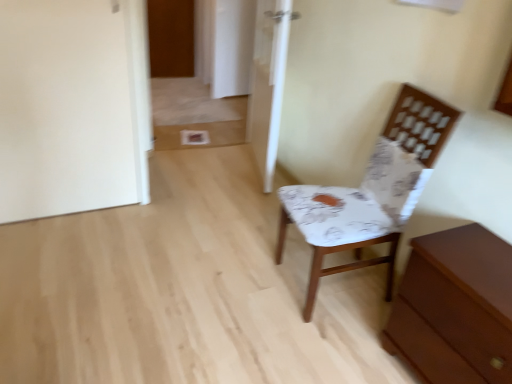
What do you see at coordinates (371, 192) in the screenshot?
I see `white fabric chair at right` at bounding box center [371, 192].

The height and width of the screenshot is (384, 512). Identify the location of white glossy door at center, arranged as the 1th door when ordered from the bottom. (268, 82).

Identify the location of white fabric chair at right. Image resolution: width=512 pixels, height=384 pixels. (371, 192).

Is white fabric chair at right oriented away from white glossy door at center, arranged as the 1th door when ordered from the bottom?

No, white fabric chair at right is not facing the opposite direction of white glossy door at center, arranged as the 1th door when ordered from the bottom.

Which is in front, white fabric chair at right or white glossy door at center, placed as the second door when sorted from top to bottom?

white fabric chair at right.

From the image's perspective, which one is positioned lower, white fabric chair at right or white glossy door at center, which is the second door in left-to-right order?

white fabric chair at right.

Could you measure the distance between white fabric chair at right and white glossy door at center, placed as the second door when sorted from top to bottom?

They are 3.69 feet apart.

Considering the points (150, 67) and (394, 252), which point is in front, point (150, 67) or point (394, 252)?

The point (394, 252) is closer.

There is a white fabric chair at right. Where is `the 2nd door above it (from the image's perspective)`? Image resolution: width=512 pixels, height=384 pixels. the 2nd door above it (from the image's perspective) is located at coordinates (170, 37).

Is wooden door at upper left, positioned as the second door in bottom-to-top order, facing towards white fabric chair at right?

Yes, wooden door at upper left, positioned as the second door in bottom-to-top order, is turned towards white fabric chair at right.

Between point (284, 28) and point (295, 207), which one is positioned behind?

Positioned behind is point (284, 28).

From the picture: From a real-world perspective, between white glossy door at center, arranged as the 1th door when ordered from the bottom, and white fabric chair at right, who is vertically lower?

white fabric chair at right, from a real-world perspective.

How much distance is there between white glossy door at center, arranged as the 1th door when ordered from the bottom, and white fabric chair at right?

white glossy door at center, arranged as the 1th door when ordered from the bottom, is 3.69 feet away from white fabric chair at right.

Is brown wooden chest of drawers at lower right oriented towards wooden door at upper left, which is counted as the 2th door, starting from the right?

No.

Is the position of brown wooden chest of drawers at lower right less distant than that of wooden door at upper left, which is counted as the 2th door, starting from the right?

Yes, brown wooden chest of drawers at lower right is closer to the viewer.

Is brown wooden chest of drawers at lower right to the right of wooden door at upper left, which is counted as the 2th door, starting from the right, from the viewer's perspective?

Indeed, brown wooden chest of drawers at lower right is positioned on the right side of wooden door at upper left, which is counted as the 2th door, starting from the right.

Is wooden door at upper left, arranged as the first door when viewed from the back, outside of white glossy door at center, placed as the second door when sorted from top to bottom?

Yes.

From a real-world perspective, which object stands above the other?

white glossy door at center, the 2th door when ordered from back to front, is physically above.

Is brown wooden chest of drawers at lower right with white glossy door at center, arranged as the 1th door when ordered from the bottom?

No, brown wooden chest of drawers at lower right is not touching white glossy door at center, arranged as the 1th door when ordered from the bottom.

Which of these two, brown wooden chest of drawers at lower right or white glossy door at center, placed as the second door when sorted from top to bottom, stands shorter?

With less height is brown wooden chest of drawers at lower right.

Between brown wooden chest of drawers at lower right and white glossy door at center, the 2th door when ordered from back to front, which one has larger width?

With larger width is brown wooden chest of drawers at lower right.

From a real-world perspective, is brown wooden chest of drawers at lower right positioned under white glossy door at center, which is the second door in left-to-right order, based on gravity?

Indeed, from a real-world perspective, brown wooden chest of drawers at lower right is positioned beneath white glossy door at center, which is the second door in left-to-right order.

In the scene shown: Is brown wooden chest of drawers at lower right with white fabric chair at right?

No, brown wooden chest of drawers at lower right is not beside white fabric chair at right.

From a real-world perspective, is brown wooden chest of drawers at lower right physically above white fabric chair at right?

Actually, brown wooden chest of drawers at lower right is physically below white fabric chair at right in the real world.

Based on the photo, in terms of size, does brown wooden chest of drawers at lower right appear bigger or smaller than white fabric chair at right?

In the image, brown wooden chest of drawers at lower right appears to be smaller than white fabric chair at right.

Where is `chair below the white glossy door at center, the 2th door when ordered from back to front (from the image's perspective)`? This screenshot has width=512, height=384. chair below the white glossy door at center, the 2th door when ordered from back to front (from the image's perspective) is located at coordinates (371, 192).

This screenshot has height=384, width=512. Identify the location of chair on the right of the wooden door at upper left, acting as the first door starting from the left. (371, 192).

Looking at the image, which one is located further to wooden door at upper left, which is counted as the 2th door, starting from the right, white glossy door at center, placed as the second door when sorted from top to bottom, or brown wooden chest of drawers at lower right?

brown wooden chest of drawers at lower right is positioned further to the anchor wooden door at upper left, which is counted as the 2th door, starting from the right.

When comparing their distances from white glossy door at center, the 2th door when ordered from back to front, does brown wooden chest of drawers at lower right or white fabric chair at right seem closer?

white fabric chair at right is positioned closer to the anchor white glossy door at center, the 2th door when ordered from back to front.

Considering their positions, is white glossy door at center, placed as the second door when sorted from top to bottom, positioned further to white fabric chair at right than brown wooden chest of drawers at lower right?

Based on the image, white glossy door at center, placed as the second door when sorted from top to bottom, appears to be further to white fabric chair at right.

Which object lies nearer to the anchor point white glossy door at center, placed as the 1th door when sorted from right to left, wooden door at upper left, which is counted as the 1th door, starting from the top, or white fabric chair at right?

The object closer to white glossy door at center, placed as the 1th door when sorted from right to left, is white fabric chair at right.

Estimate the real-world distances between objects in this image. Which object is closer to brown wooden chest of drawers at lower right, white fabric chair at right or white glossy door at center, placed as the 1th door when sorted from right to left?

white fabric chair at right is positioned closer to the anchor brown wooden chest of drawers at lower right.

Considering their positions, is wooden door at upper left, arranged as the first door when viewed from the back, positioned closer to brown wooden chest of drawers at lower right than white fabric chair at right?

The object closer to brown wooden chest of drawers at lower right is white fabric chair at right.

Looking at the image, which one is located closer to wooden door at upper left, which is counted as the 1th door, starting from the top, brown wooden chest of drawers at lower right or white glossy door at center, arranged as the 1th door when ordered from the bottom?

Based on the image, white glossy door at center, arranged as the 1th door when ordered from the bottom, appears to be nearer to wooden door at upper left, which is counted as the 1th door, starting from the top.

Considering their positions, is white fabric chair at right positioned further to white glossy door at center, which is the second door in left-to-right order, than brown wooden chest of drawers at lower right?

Based on the image, brown wooden chest of drawers at lower right appears to be further to white glossy door at center, which is the second door in left-to-right order.

The image size is (512, 384). Identify the location of door between white fabric chair at right and wooden door at upper left, which is counted as the 2th door, starting from the right, from front to back. (268, 82).

At what (x,y) coordinates should I click in order to perform the action: click on door positioned between brown wooden chest of drawers at lower right and wooden door at upper left, positioned as the second door in bottom-to-top order, from near to far. Please return your answer as a coordinate pair (x, y). The height and width of the screenshot is (384, 512). Looking at the image, I should click on (268, 82).

Where is `chair between white glossy door at center, placed as the 1th door when sorted from right to left, and brown wooden chest of drawers at lower right from top to bottom`? Image resolution: width=512 pixels, height=384 pixels. chair between white glossy door at center, placed as the 1th door when sorted from right to left, and brown wooden chest of drawers at lower right from top to bottom is located at coordinates (371, 192).

You are a GUI agent. You are given a task and a screenshot of the screen. Output one action in this format:
    pyautogui.click(x=<x>, y=<y>)
    Task: Click on the chair between brown wooden chest of drawers at lower right and wooden door at upper left, which is counted as the 2th door, starting from the right, from front to back
    Image resolution: width=512 pixels, height=384 pixels.
    Given the screenshot: What is the action you would take?
    pyautogui.click(x=371, y=192)